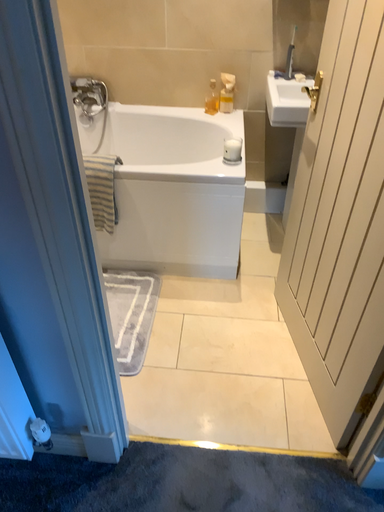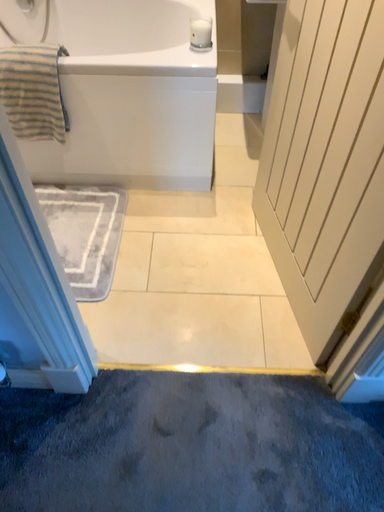
Question: Which way did the camera rotate in the video?

Choices:
 (A) rotated downward
 (B) rotated upward

Answer: (A)